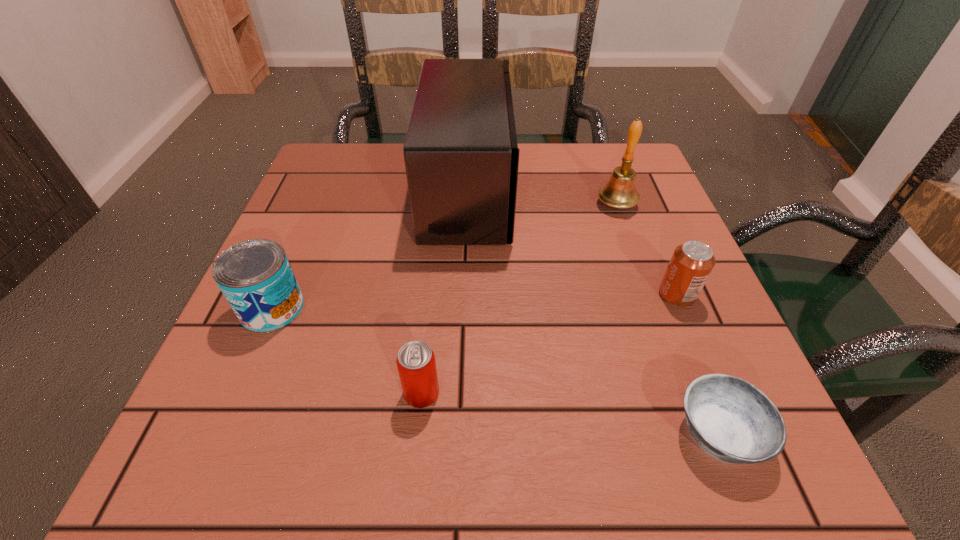
At what (x,y) coordinates should I click in order to perform the action: click on microwave_oven. Please return your answer as a coordinate pair (x, y). Looking at the image, I should click on (461, 156).

Where is `bell`? Image resolution: width=960 pixels, height=540 pixels. bell is located at coordinates (619, 192).

Locate an element on the screen. This screenshot has width=960, height=540. the leftmost can is located at coordinates (255, 276).

Image resolution: width=960 pixels, height=540 pixels. What are the coordinates of `the rightmost can` in the screenshot? It's located at (692, 262).

At what (x,y) coordinates should I click in order to perform the action: click on the second can from right to left. Please return your answer as a coordinate pair (x, y). Image resolution: width=960 pixels, height=540 pixels. Looking at the image, I should click on (416, 364).

Identify the location of the shortest object. (733, 421).

Where is `free point located on the front-facing side of the microwave_oven`? This screenshot has width=960, height=540. free point located on the front-facing side of the microwave_oven is located at coordinates [x=657, y=190].

Where is `vacant space located on the left of the bell`? This screenshot has height=540, width=960. vacant space located on the left of the bell is located at coordinates (569, 205).

Locate an element on the screen. This screenshot has height=540, width=960. vacant area located 0.140m on the back of the leftmost object is located at coordinates (303, 235).

Where is `vacant space located on the back of the rightmost can`? This screenshot has height=540, width=960. vacant space located on the back of the rightmost can is located at coordinates (629, 180).